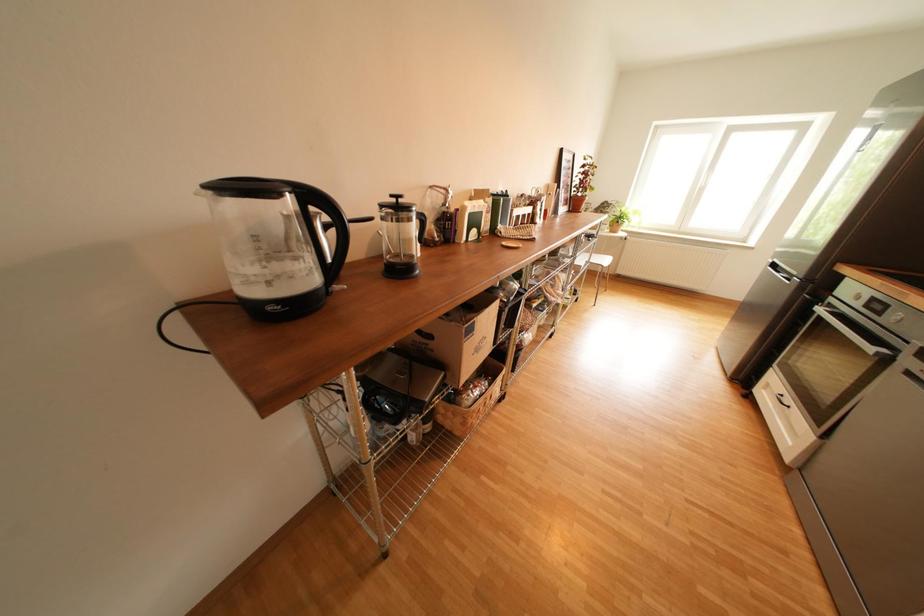
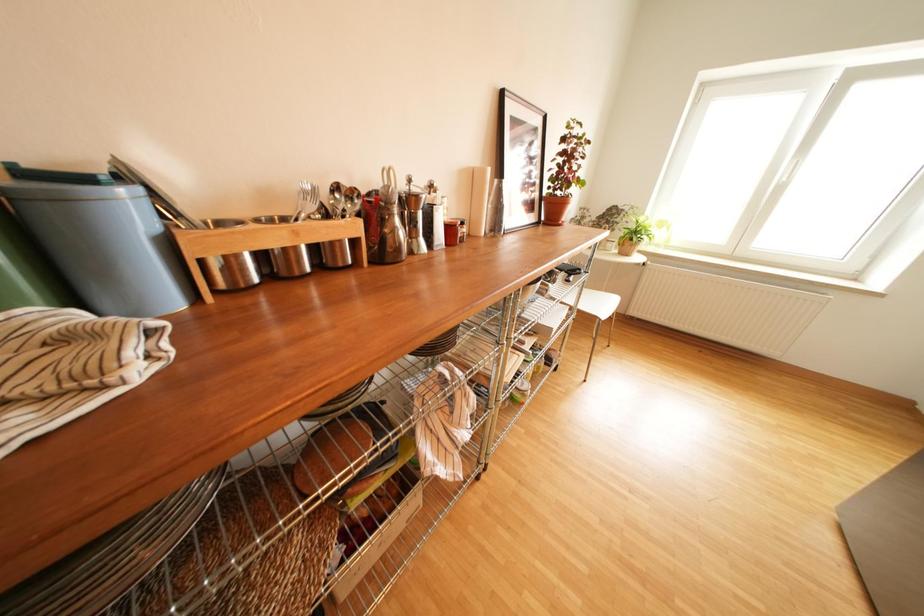
In a continuous first-person perspective shot, in which direction is the camera moving?

The cameraman moved toward right, forward.